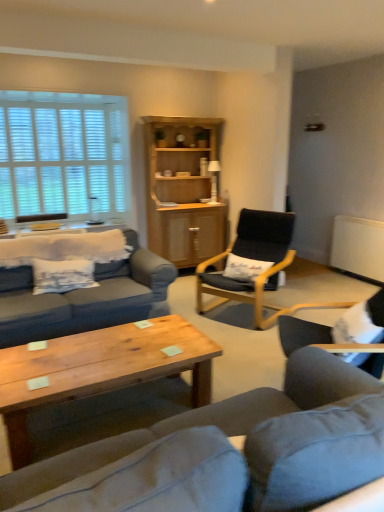
Question: Considering the positions of point (34, 480) and point (261, 245), is point (34, 480) closer or farther from the camera than point (261, 245)?

Choices:
 (A) closer
 (B) farther

Answer: (A)

Question: From the image's perspective, is matte gray couch at center positioned above or below black fabric chair at center, the 2th chair when ordered from front to back?

Choices:
 (A) above
 (B) below

Answer: (B)

Question: Estimate the real-world distances between objects in this image. Which object is farther from the white wooden blinds at upper left?

Choices:
 (A) matte gray couch at center
 (B) white fur chair at lower right, acting as the 2th chair starting from the back
 (C) black fabric chair at center, the 2th chair when ordered from front to back
 (D) wooden coffee table at center
 (E) wooden table at left

Answer: (A)

Question: Based on their relative distances, which object is nearer to the white wooden blinds at upper left?

Choices:
 (A) white fur chair at lower right, arranged as the first chair when viewed from the front
 (B) white fabric pillow at center
 (C) black fabric chair at center, the 2th chair when ordered from front to back
 (D) light wood cabinet at center
 (E) wooden coffee table at center

Answer: (D)